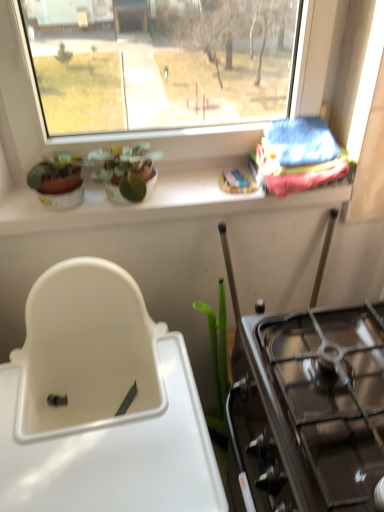
Find the location of a particular element. This screenshot has width=384, height=512. empty space that is to the right of matte ceramic plant at upper center is located at coordinates (188, 181).